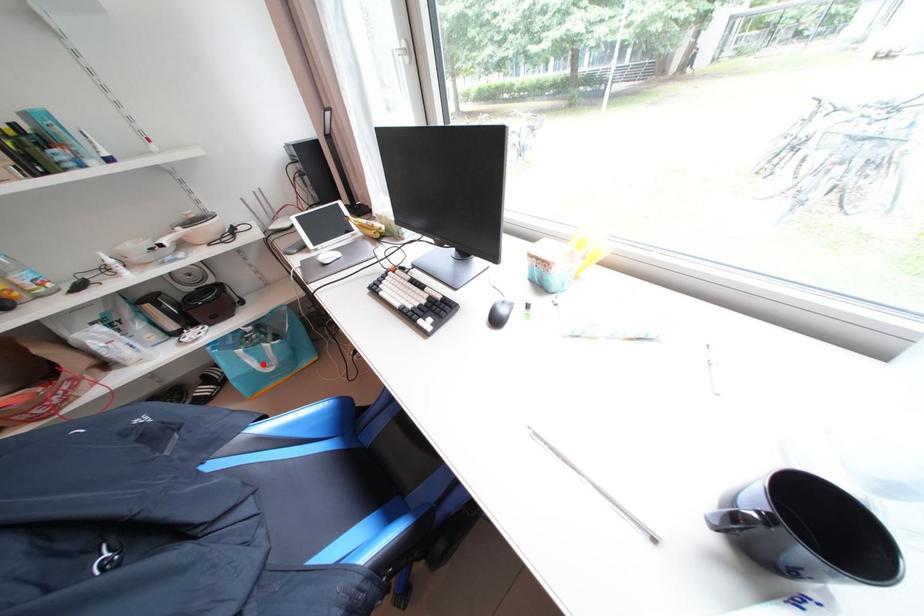
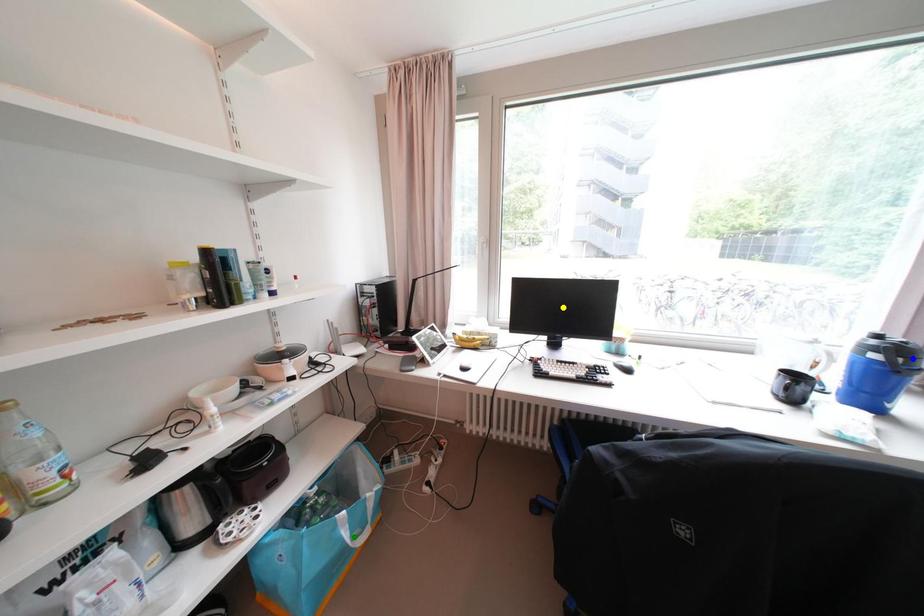
Question: I am providing you with two images of the same scene from different viewpoints. A red point is marked on the first image. You are given multiple points on the second image. Can you choose the point in image 2 that corresponds to the point in image 1?

Choices:
 (A) yellow point
 (B) blue point
 (C) green point

Answer: (C)